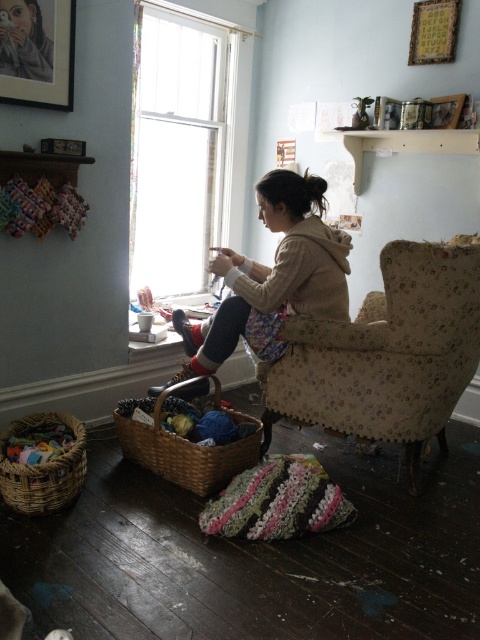
Does floral fabric armchair at center have a greater height compared to matte beige hoodie at center?

Indeed, floral fabric armchair at center has a greater height compared to matte beige hoodie at center.

Can you confirm if floral fabric armchair at center is positioned to the right of matte beige hoodie at center?

Correct, you'll find floral fabric armchair at center to the right of matte beige hoodie at center.

The width and height of the screenshot is (480, 640). Describe the element at coordinates (386, 353) in the screenshot. I see `floral fabric armchair at center` at that location.

Where is `floral fabric armchair at center`? This screenshot has height=640, width=480. floral fabric armchair at center is located at coordinates coord(386,353).

Can you confirm if white glass window at upper center is wider than wooden picture frame at upper right?

Yes, white glass window at upper center is wider than wooden picture frame at upper right.

The width and height of the screenshot is (480, 640). Describe the element at coordinates (180, 145) in the screenshot. I see `white glass window at upper center` at that location.

I want to click on white glass window at upper center, so click(x=180, y=145).

Which is in front, point (387, 349) or point (34, 497)?

Point (34, 497) is more forward.

Is floral fabric armchair at center thinner than woven brown basket at lower left?

No.

Identify the location of floral fabric armchair at center. This screenshot has height=640, width=480. (386, 353).